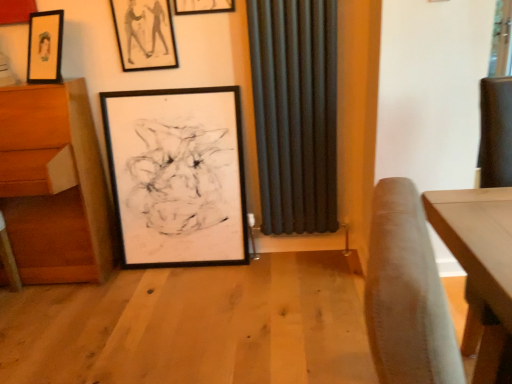
The image size is (512, 384). I want to click on dark matte radiator at center, so click(295, 112).

Identify the location of black matte picture frame at center, acting as the third picture frame starting from the top. The image size is (512, 384). (178, 175).

Locate an element on the screen. wooden drawer at left is located at coordinates (54, 185).

Where is `matte black picture frame at upper center, which is counted as the 3th picture frame, starting from the bottom`? matte black picture frame at upper center, which is counted as the 3th picture frame, starting from the bottom is located at coordinates (202, 6).

Are black matte picture frame at center, acting as the third picture frame starting from the top, and matte black picture frame at upper center, which ranks as the second picture frame in top-to-bottom order, located far from each other?

black matte picture frame at center, acting as the third picture frame starting from the top, is actually quite close to matte black picture frame at upper center, which ranks as the second picture frame in top-to-bottom order.

How many degrees apart are the facing directions of black matte picture frame at center, the 1th picture frame positioned from the bottom, and matte black picture frame at upper center, which ranks as the second picture frame in top-to-bottom order?

1.47 degrees separate the facing orientations of black matte picture frame at center, the 1th picture frame positioned from the bottom, and matte black picture frame at upper center, which ranks as the second picture frame in top-to-bottom order.

Is black matte picture frame at center, the 1th picture frame positioned from the bottom, wider than matte black picture frame at upper center, the second picture frame when ordered from bottom to top?

Yes.

From the picture: From a real-world perspective, is black matte picture frame at center, the 1th picture frame positioned from the bottom, physically located above or below matte black picture frame at upper center, the second picture frame when ordered from bottom to top?

In terms of real-world spatial position, black matte picture frame at center, the 1th picture frame positioned from the bottom, is below matte black picture frame at upper center, the second picture frame when ordered from bottom to top.

Could you tell me if dark matte radiator at center is facing matte black picture frame at upper center, which appears as the first picture frame when viewed from the top?

No, dark matte radiator at center does not turn towards matte black picture frame at upper center, which appears as the first picture frame when viewed from the top.

Who is smaller, dark matte radiator at center or matte black picture frame at upper center, which is counted as the 3th picture frame, starting from the bottom?

Smaller between the two is matte black picture frame at upper center, which is counted as the 3th picture frame, starting from the bottom.

Which point is more forward, (324, 190) or (194, 0)?

The point (194, 0) is closer to the camera.

Can you confirm if dark matte radiator at center is taller than matte black picture frame at upper center, which is counted as the 3th picture frame, starting from the bottom?

Yes.

Looking at this image, from the image's perspective, who appears lower, matte black picture frame at upper center, which ranks as the second picture frame in top-to-bottom order, or matte black picture frame at upper center, which appears as the first picture frame when viewed from the top?

matte black picture frame at upper center, which ranks as the second picture frame in top-to-bottom order.

Is matte black picture frame at upper center, which ranks as the second picture frame in top-to-bottom order, bigger than matte black picture frame at upper center, which is counted as the 3th picture frame, starting from the bottom?

Correct, matte black picture frame at upper center, which ranks as the second picture frame in top-to-bottom order, is larger in size than matte black picture frame at upper center, which is counted as the 3th picture frame, starting from the bottom.

Who is taller, matte black picture frame at upper center, which ranks as the second picture frame in top-to-bottom order, or matte black picture frame at upper center, which appears as the first picture frame when viewed from the top?

Standing taller between the two is matte black picture frame at upper center, which ranks as the second picture frame in top-to-bottom order.

Does matte black picture frame at upper center, which ranks as the second picture frame in top-to-bottom order, come behind matte black picture frame at upper center, which is counted as the 3th picture frame, starting from the bottom?

Yes.

Considering their positions, is matte black picture frame at upper center, which ranks as the second picture frame in top-to-bottom order, located in front of or behind wooden drawer at left?

In the image, matte black picture frame at upper center, which ranks as the second picture frame in top-to-bottom order, appears behind wooden drawer at left.

Considering the sizes of objects matte black picture frame at upper center, which ranks as the second picture frame in top-to-bottom order, and wooden drawer at left in the image provided, who is smaller, matte black picture frame at upper center, which ranks as the second picture frame in top-to-bottom order, or wooden drawer at left?

With smaller size is matte black picture frame at upper center, which ranks as the second picture frame in top-to-bottom order.

How distant is matte black picture frame at upper center, the second picture frame when ordered from bottom to top, from wooden drawer at left?

matte black picture frame at upper center, the second picture frame when ordered from bottom to top, is 23.01 inches from wooden drawer at left.

Can you confirm if matte black picture frame at upper center, the second picture frame when ordered from bottom to top, is taller than wooden drawer at left?

In fact, matte black picture frame at upper center, the second picture frame when ordered from bottom to top, may be shorter than wooden drawer at left.

Which is less distant, [262,231] or [126,28]?

The point [126,28] is in front.

From the image's perspective, is dark matte radiator at center located above or below matte black picture frame at upper center, which ranks as the second picture frame in top-to-bottom order?

dark matte radiator at center is situated lower than matte black picture frame at upper center, which ranks as the second picture frame in top-to-bottom order, in the image.

How different are the orientations of dark matte radiator at center and matte black picture frame at upper center, which ranks as the second picture frame in top-to-bottom order, in degrees?

The facing directions of dark matte radiator at center and matte black picture frame at upper center, which ranks as the second picture frame in top-to-bottom order, are 0.361 degrees apart.

From the picture: Does dark matte radiator at center have a greater width compared to matte black picture frame at upper center, which ranks as the second picture frame in top-to-bottom order?

Yes.

Is dark matte radiator at center surrounded by black matte picture frame at center, the 1th picture frame positioned from the bottom?

No, dark matte radiator at center is not surrounded by black matte picture frame at center, the 1th picture frame positioned from the bottom.

From a real-world perspective, which is physically above, black matte picture frame at center, the 1th picture frame positioned from the bottom, or dark matte radiator at center?

dark matte radiator at center, from a real-world perspective.

Between black matte picture frame at center, the 1th picture frame positioned from the bottom, and dark matte radiator at center, which one has less height?

With less height is black matte picture frame at center, the 1th picture frame positioned from the bottom.

From the image's perspective, which one is positioned lower, black matte picture frame at center, acting as the third picture frame starting from the top, or dark matte radiator at center?

black matte picture frame at center, acting as the third picture frame starting from the top, is shown below in the image.

From the image's perspective, which is above, wooden drawer at left or matte black picture frame at upper center, which ranks as the second picture frame in top-to-bottom order?

matte black picture frame at upper center, which ranks as the second picture frame in top-to-bottom order.

Is wooden drawer at left beside matte black picture frame at upper center, which ranks as the second picture frame in top-to-bottom order?

No, wooden drawer at left is not beside matte black picture frame at upper center, which ranks as the second picture frame in top-to-bottom order.

Is matte black picture frame at upper center, which ranks as the second picture frame in top-to-bottom order, located within wooden drawer at left?

No, matte black picture frame at upper center, which ranks as the second picture frame in top-to-bottom order, is not inside wooden drawer at left.

The image size is (512, 384). I want to click on picture frame located below the matte black picture frame at upper center, which ranks as the second picture frame in top-to-bottom order (from the image's perspective), so click(x=178, y=175).

Which picture frame is the 1st one when counting from the left side of the dark matte radiator at center? Please provide its 2D coordinates.

[(202, 6)]

From the image, which object appears to be farther from matte black picture frame at upper center, the second picture frame when ordered from bottom to top, black matte picture frame at center, the 1th picture frame positioned from the bottom, or dark matte radiator at center?

dark matte radiator at center is positioned further to the anchor matte black picture frame at upper center, the second picture frame when ordered from bottom to top.

Looking at the image, which one is located closer to matte black picture frame at upper center, which appears as the first picture frame when viewed from the top, black matte picture frame at center, the 1th picture frame positioned from the bottom, or matte black picture frame at upper center, the second picture frame when ordered from bottom to top?

matte black picture frame at upper center, the second picture frame when ordered from bottom to top, is positioned closer to the anchor matte black picture frame at upper center, which appears as the first picture frame when viewed from the top.

From the image, which object appears to be nearer to matte black picture frame at upper center, which ranks as the second picture frame in top-to-bottom order, wooden drawer at left or dark matte radiator at center?

wooden drawer at left lies closer to matte black picture frame at upper center, which ranks as the second picture frame in top-to-bottom order, than the other object.

Looking at this image, based on their spatial positions, is matte black picture frame at upper center, which ranks as the second picture frame in top-to-bottom order, or dark matte radiator at center further from wooden drawer at left?

Based on the image, dark matte radiator at center appears to be further to wooden drawer at left.

Based on their spatial positions, is wooden drawer at left or matte black picture frame at upper center, which appears as the first picture frame when viewed from the top, closer to black matte picture frame at center, the 1th picture frame positioned from the bottom?

The object closer to black matte picture frame at center, the 1th picture frame positioned from the bottom, is wooden drawer at left.

Consider the image. Estimate the real-world distances between objects in this image. Which object is further from black matte picture frame at center, acting as the third picture frame starting from the top, matte black picture frame at upper center, which is counted as the 3th picture frame, starting from the bottom, or dark matte radiator at center?

The object further to black matte picture frame at center, acting as the third picture frame starting from the top, is matte black picture frame at upper center, which is counted as the 3th picture frame, starting from the bottom.

From the image, which object appears to be nearer to matte black picture frame at upper center, which appears as the first picture frame when viewed from the top, dark matte radiator at center or wooden drawer at left?

dark matte radiator at center lies closer to matte black picture frame at upper center, which appears as the first picture frame when viewed from the top, than the other object.

From the image, which object appears to be nearer to wooden drawer at left, black matte picture frame at center, the 1th picture frame positioned from the bottom, or matte black picture frame at upper center, the second picture frame when ordered from bottom to top?

Based on the image, black matte picture frame at center, the 1th picture frame positioned from the bottom, appears to be nearer to wooden drawer at left.

Locate an element on the screen. The image size is (512, 384). curtain between matte black picture frame at upper center, which is counted as the 3th picture frame, starting from the bottom, and black matte picture frame at center, the 1th picture frame positioned from the bottom, vertically is located at coordinates (295, 112).

I want to click on picture frame that lies between matte black picture frame at upper center, which is counted as the 3th picture frame, starting from the bottom, and black matte picture frame at center, acting as the third picture frame starting from the top, from top to bottom, so [144, 34].

You are a GUI agent. You are given a task and a screenshot of the screen. Output one action in this format:
    pyautogui.click(x=<x>, y=<y>)
    Task: Click on the picture frame between matte black picture frame at upper center, which ranks as the second picture frame in top-to-bottom order, and wooden drawer at left in the up-down direction
    The height and width of the screenshot is (384, 512).
    Given the screenshot: What is the action you would take?
    pyautogui.click(x=178, y=175)